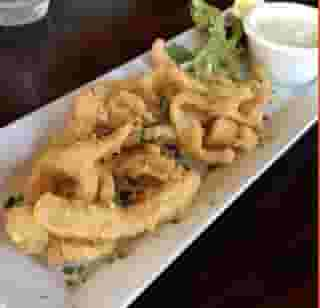
Where is `small cup`? This screenshot has height=308, width=320. small cup is located at coordinates (294, 68).